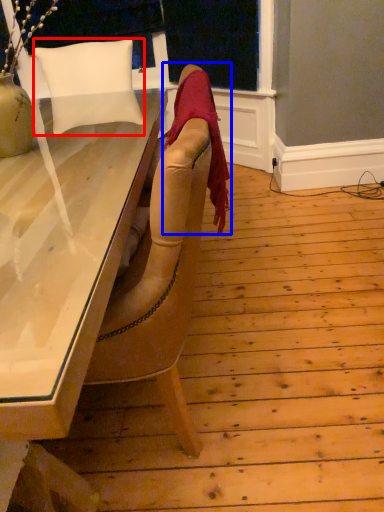
Question: Among these objects, which one is farthest to the camera, pillow (highlighted by a red box) or blanket (highlighted by a blue box)?

Choices:
 (A) pillow
 (B) blanket

Answer: (A)